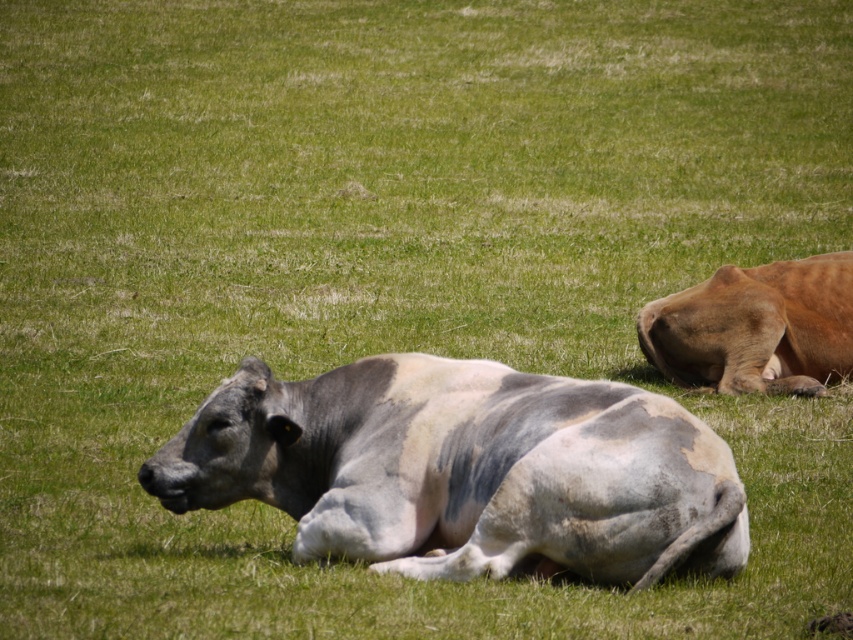
You are standing in the field and want to walk to the cow in the foreground. Which point should you head towards, point (228, 426) or point (833, 257)?

You should head towards point (228, 426) because it is closer to the camera, which is where you are standing in the field.

You are standing at the camera position and want to throw a ball to the speckled gray cow at center. If the ball travels in a straight line, how far will it have to travel to reach the cow?

The speckled gray cow at center is 6.47 meters from camera, so the ball will have to travel 6.47 meters to reach the cow.